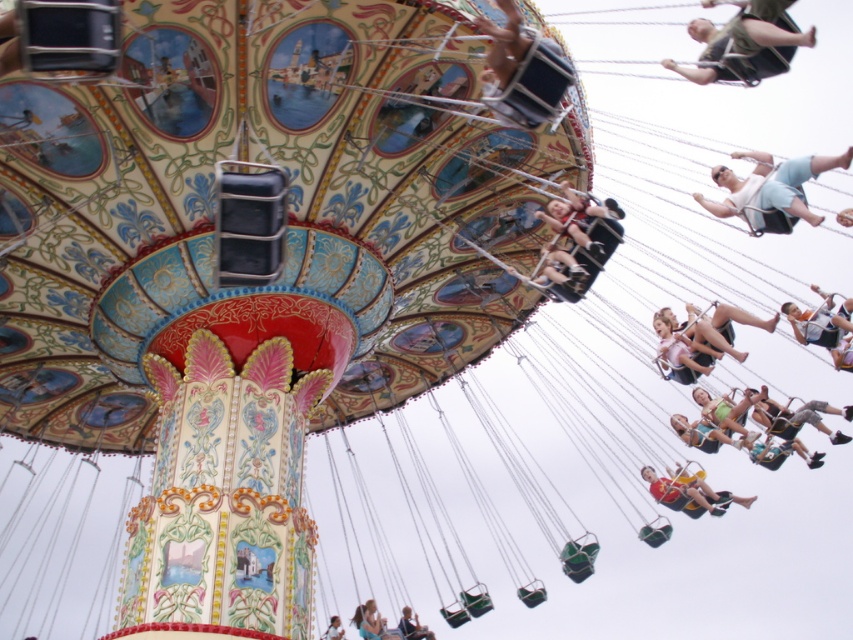
Which is in front, point (787, 40) or point (729, 500)?

Point (787, 40) is in front.

Between dark green fabric swing at upper right and yellow fabric swing at lower right, which one appears on the left side from the viewer's perspective?

Positioned to the left is yellow fabric swing at lower right.

This screenshot has width=853, height=640. I want to click on dark green fabric swing at upper right, so click(x=743, y=44).

Between light brown fabric swing at upper right and light brown wooden swing at upper center, which one has less height?

light brown fabric swing at upper right is shorter.

Is light brown fabric swing at upper right to the right of light brown wooden swing at upper center from the viewer's perspective?

Indeed, light brown fabric swing at upper right is positioned on the right side of light brown wooden swing at upper center.

Between point (819, 342) and point (323, 634), which one is positioned in front?

Point (819, 342) is in front.

Find the location of a particular element. light brown fabric swing at upper right is located at coordinates (824, 326).

Measure the distance between pink fabric swing at center and camera.

They are 79.38 meters apart.

Who is positioned more to the right, pink fabric swing at center or dark blue jeans at lower right?

From the viewer's perspective, dark blue jeans at lower right appears more on the right side.

Is point (701, 321) positioned behind point (764, 417)?

No, (701, 321) is closer to viewer.

This screenshot has height=640, width=853. I want to click on pink fabric swing at center, so click(x=712, y=326).